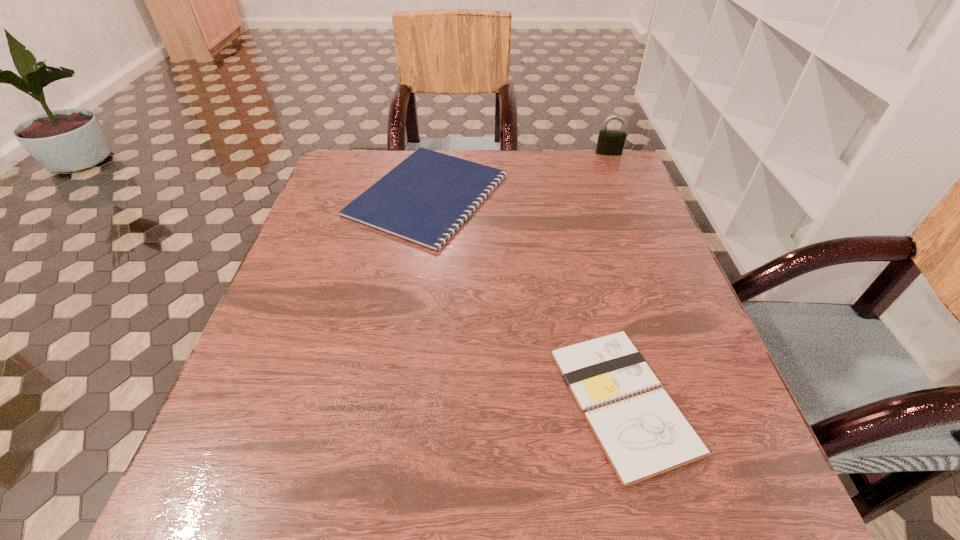
I want to click on object situated at the near edge, so click(642, 436).

Locate an element on the screen. This screenshot has width=960, height=540. object at the left edge is located at coordinates [x=424, y=199].

Where is `padlock positioned at the right edge`? padlock positioned at the right edge is located at coordinates (611, 143).

In order to click on notepad that is at the right edge in this screenshot , I will do `click(642, 436)`.

What are the coordinates of `object at the far left corner` in the screenshot? It's located at (424, 199).

Locate an element on the screen. object present at the far right corner is located at coordinates (611, 143).

I want to click on object that is at the near right corner, so click(x=642, y=436).

I want to click on vacant space at the far edge, so (x=469, y=150).

Identify the location of vacant space at the near edge of the desktop. (310, 518).

Where is `free space at the left edge`? This screenshot has height=540, width=960. free space at the left edge is located at coordinates (350, 292).